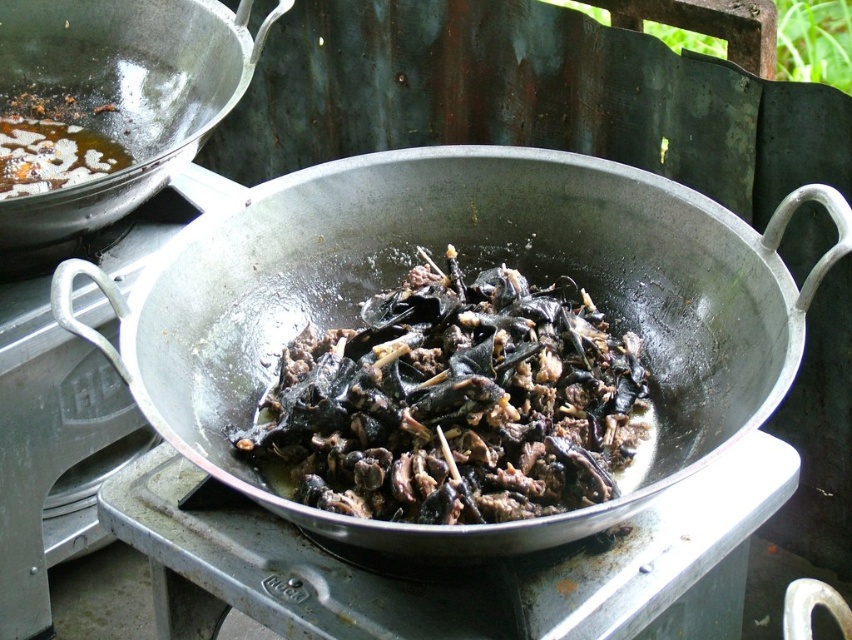
Question: Which object appears farthest from the camera in this image?

Choices:
 (A) shiny metallic wok at upper left
 (B) black matte food at center
 (C) black matte wok at center

Answer: (A)

Question: Estimate the real-world distances between objects in this image. Which object is closer to the black matte food at center?

Choices:
 (A) black matte wok at center
 (B) shiny metallic wok at upper left

Answer: (A)

Question: Is black matte wok at center above black matte food at center?

Choices:
 (A) yes
 (B) no

Answer: (A)

Question: Does black matte wok at center appear over shiny metallic wok at upper left?

Choices:
 (A) yes
 (B) no

Answer: (B)

Question: Can you confirm if black matte wok at center is bigger than shiny metallic wok at upper left?

Choices:
 (A) no
 (B) yes

Answer: (B)

Question: Among these points, which one is nearest to the camera?

Choices:
 (A) (380, 444)
 (B) (128, 12)
 (C) (734, 284)

Answer: (A)